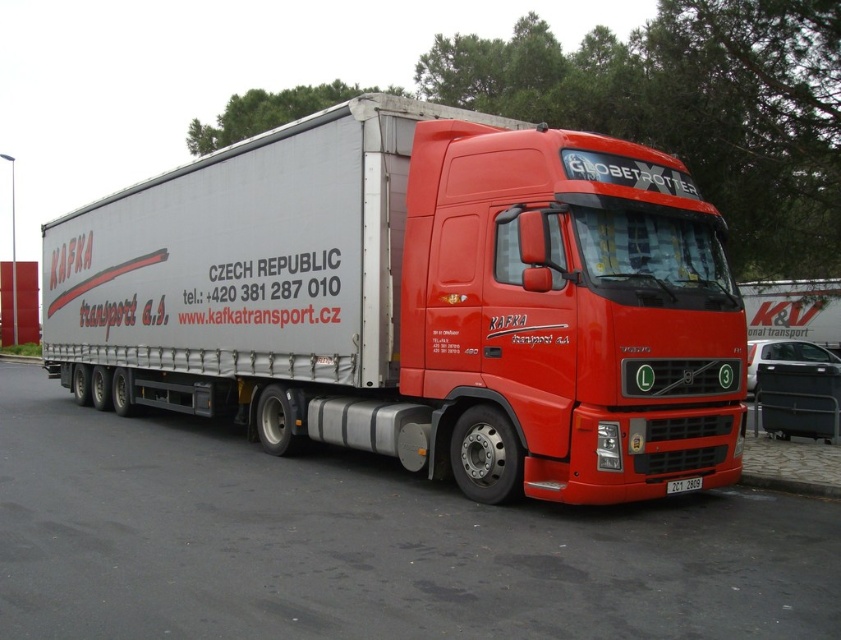
In the scene shown: You are a delivery driver who needs to back up the truck into a loading dock. The loading dock has a clearance of 2.5 meters. Can you safely back the truck up without hitting the matte white trailer at center or the black plastic license plate at bottom center?

The matte white trailer at center is 2.57 meters away from the black plastic license plate at bottom center. Since the clearance is only 2.5 meters, backing up the truck may result in a collision between the trailer and the license plate, so it is not safe to proceed.

You are a delivery driver who needs to park your truck in a parking lot. The parking lot has a designated parking spot with coordinates from 0.7 to 0.9 on the x and y axes. Based on the image, is the matte white trailer at center parked within the designated parking spot?

The position of matte white trailer at center is at point (366, 545). Since the designated parking spot spans from 0.7 to 0.9 on both axes, the trailer is within the designated area as its coordinates fall within the specified range.

You are a delivery driver who needs to locate the trailer of the Volvo Globetrotter truck in the image. According to the coordinates provided, where exactly is the metallic silver trailer at center located?

The metallic silver trailer at center is located at coordinates point (419, 301).